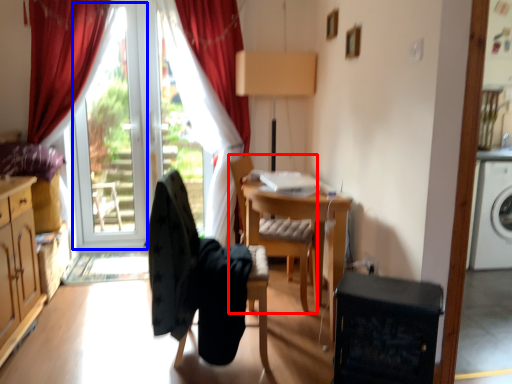
Question: Which object appears closest to the camera in this image, chair (highlighted by a red box) or window screen (highlighted by a blue box)?

Choices:
 (A) chair
 (B) window screen

Answer: (A)